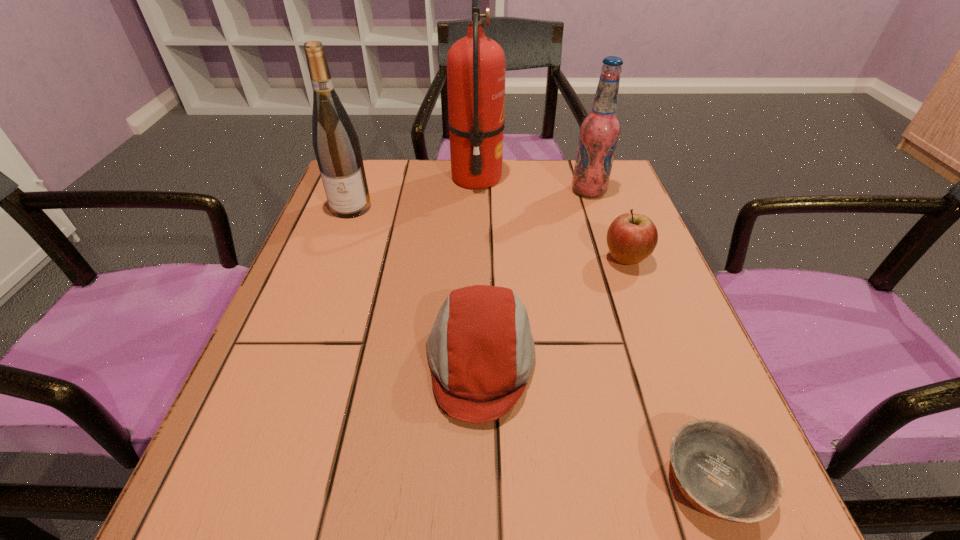
At what (x,y) coordinates should I click in order to perform the action: click on alcohol at the right edge. Please return your answer as a coordinate pair (x, y). The height and width of the screenshot is (540, 960). Looking at the image, I should click on (599, 131).

This screenshot has width=960, height=540. In order to click on apple positioned at the right edge in this screenshot , I will do `click(631, 238)`.

Locate an element on the screen. The image size is (960, 540). bowl present at the right edge is located at coordinates (721, 470).

Find the location of a particular element. This screenshot has height=540, width=960. object present at the far left corner is located at coordinates (336, 145).

Image resolution: width=960 pixels, height=540 pixels. I want to click on object present at the far right corner, so click(x=599, y=131).

In order to click on object located at the near right corner in this screenshot , I will do `click(721, 470)`.

Image resolution: width=960 pixels, height=540 pixels. Find the location of `blank space at the far edge of the desktop`. blank space at the far edge of the desktop is located at coordinates (439, 200).

In the image, there is a desktop. At what (x,y) coordinates should I click in order to perform the action: click on vacant space at the near edge. Please return your answer as a coordinate pair (x, y). The image size is (960, 540). Looking at the image, I should click on (364, 472).

Identify the location of free space at the left edge. (275, 413).

This screenshot has width=960, height=540. In order to click on vacant space at the right edge of the desktop in this screenshot , I will do `click(703, 402)`.